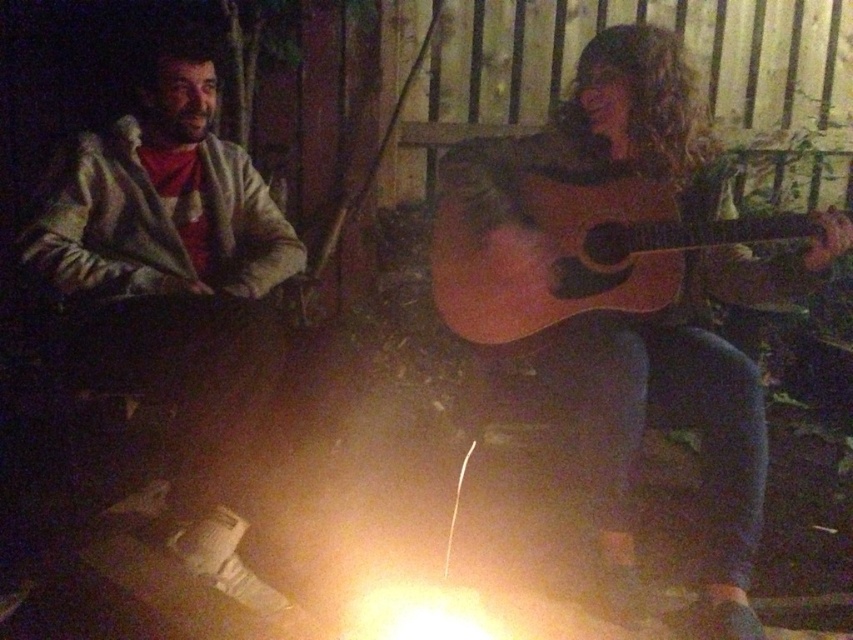
Is point (683, 355) more distant than point (612, 305)?

No.

Can you confirm if wooden acoustic guitar at right is bigger than light brown acoustic guitar at right?

A: Yes.

Is point (738, 394) farther from viewer compared to point (612, 268)?

No.

This screenshot has height=640, width=853. What are the coordinates of `wooden acoustic guitar at right` in the screenshot? It's located at (683, 410).